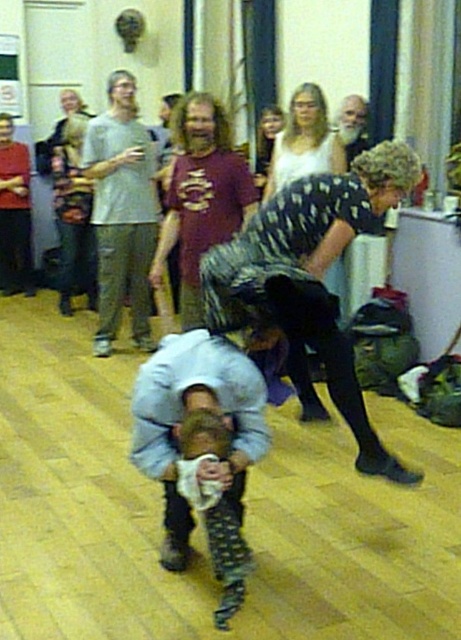
Between light gray t-shirt at upper left and maroon t-shirt at center, which one has less height?

With less height is maroon t-shirt at center.

Locate an element on the screen. The image size is (461, 640). light gray t-shirt at upper left is located at coordinates (122, 212).

Is light blue denim shirt at center thinner than light gray t-shirt at upper left?

Correct, light blue denim shirt at center's width is less than light gray t-shirt at upper left's.

Describe the element at coordinates (201, 449) in the screenshot. I see `light blue denim shirt at center` at that location.

Between point (195, 339) and point (101, 330), which one is positioned in front?

Point (195, 339) is in front.

Where is `light blue denim shirt at center`? light blue denim shirt at center is located at coordinates point(201,449).

From the picture: Measure the distance between point (230, 563) and camera.

Point (230, 563) is 2.47 meters from camera.

Between point (230, 403) and point (365, 148), which one is positioned behind?

Positioned behind is point (365, 148).

Where is `light blue denim shirt at center`? This screenshot has height=640, width=461. light blue denim shirt at center is located at coordinates (201, 449).

Where is `light blue denim shirt at center`? Image resolution: width=461 pixels, height=640 pixels. light blue denim shirt at center is located at coordinates (201, 449).